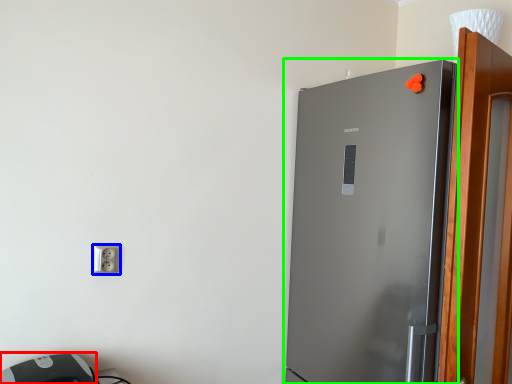
Question: Based on their relative distances, which object is nearer to appliance (highlighted by a red box)? Choose from socket (highlighted by a blue box) and refrigerator (highlighted by a green box).

Choices:
 (A) socket
 (B) refrigerator

Answer: (A)